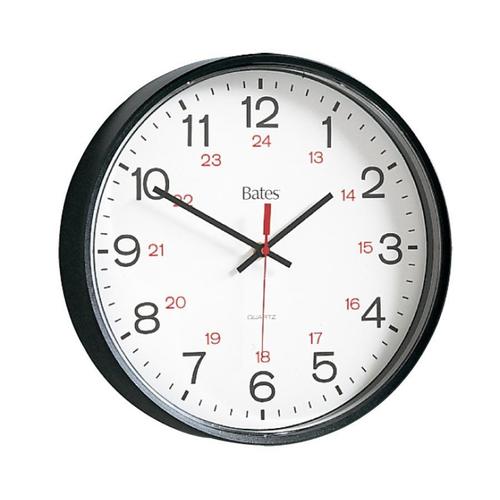
At what (x,y) coordinates should I click in order to perform the action: click on frame. Please return your answer as a coordinate pair (x, y). This screenshot has width=500, height=500. Looking at the image, I should click on (425, 165).